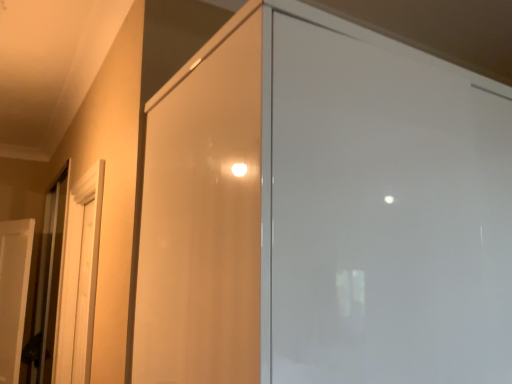
Question: Is transparent glass screen door at center, the first screen door in the right-to-left sequence, at the left side of metallic elevator door at left?

Choices:
 (A) yes
 (B) no

Answer: (B)

Question: Is transparent glass screen door at center, the first screen door positioned from the front, touching metallic elevator door at left?

Choices:
 (A) yes
 (B) no

Answer: (B)

Question: Does transparent glass screen door at center, the first screen door in the right-to-left sequence, have a greater width compared to metallic elevator door at left?

Choices:
 (A) yes
 (B) no

Answer: (A)

Question: Is transparent glass screen door at center, the first screen door positioned from the front, to the right of metallic elevator door at left from the viewer's perspective?

Choices:
 (A) no
 (B) yes

Answer: (B)

Question: From the image's perspective, is transparent glass screen door at center, the 2th screen door when ordered from left to right, located above metallic elevator door at left?

Choices:
 (A) yes
 (B) no

Answer: (A)

Question: Based on their sizes in the image, would you say transparent glass screen door at center, the first screen door positioned from the front, is bigger or smaller than metallic elevator door at left?

Choices:
 (A) big
 (B) small

Answer: (A)

Question: Considering the positions of point (437, 82) and point (67, 175), is point (437, 82) closer or farther from the camera than point (67, 175)?

Choices:
 (A) closer
 (B) farther

Answer: (A)

Question: From the image's perspective, is transparent glass screen door at center, the first screen door in the right-to-left sequence, positioned above or below metallic elevator door at left?

Choices:
 (A) above
 (B) below

Answer: (A)

Question: From a real-world perspective, is transparent glass screen door at center, the 2th screen door when ordered from left to right, above or below metallic elevator door at left?

Choices:
 (A) below
 (B) above

Answer: (B)

Question: Looking at the image, does transparent glass screen door at center, the 2th screen door when ordered from left to right, seem bigger or smaller compared to white matte door at left?

Choices:
 (A) small
 (B) big

Answer: (B)

Question: Is transparent glass screen door at center, the 2th screen door when ordered from left to right, to the left or to the right of white matte door at left in the image?

Choices:
 (A) left
 (B) right

Answer: (B)

Question: Is transparent glass screen door at center, the 2th screen door when ordered from left to right, inside or outside of white matte door at left?

Choices:
 (A) inside
 (B) outside

Answer: (B)

Question: In the image, is transparent glass screen door at center, the first screen door in the right-to-left sequence, positioned in front of or behind white matte door at left?

Choices:
 (A) front
 (B) behind

Answer: (A)

Question: Would you say white matte door at left is inside or outside matte wood screen door at left, marked as the 1th screen door in a left-to-right arrangement?

Choices:
 (A) outside
 (B) inside

Answer: (A)

Question: Looking at their shapes, would you say white matte door at left is wider or thinner than matte wood screen door at left, the second screen door positioned from the front?

Choices:
 (A) thin
 (B) wide

Answer: (B)